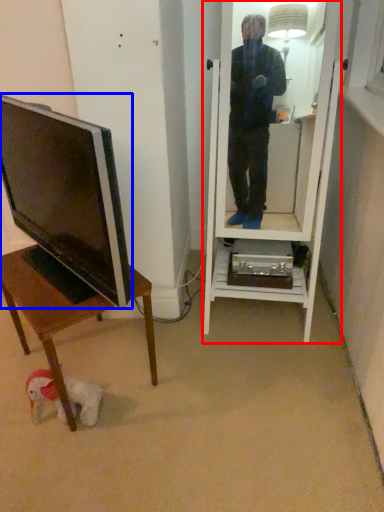
Question: Which object is further to the camera taking this photo, mirror (highlighted by a red box) or television (highlighted by a blue box)?

Choices:
 (A) mirror
 (B) television

Answer: (A)